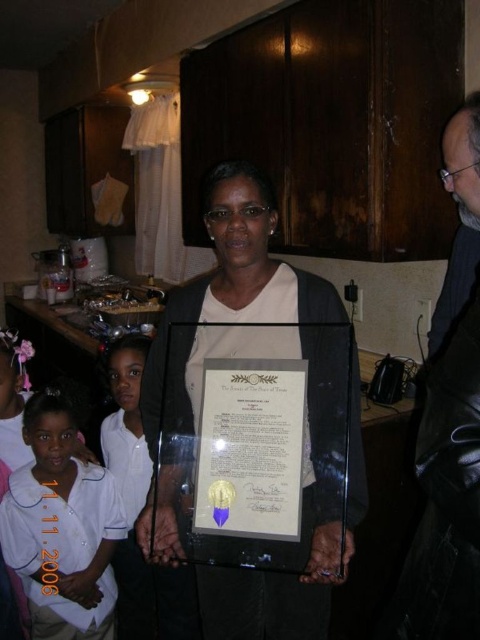
Question: Which object is the farthest from the matte black frame at center?

Choices:
 (A) white cotton shirt at lower left
 (B) matte gold certificate at center

Answer: (A)

Question: Observing the image, what is the correct spatial positioning of matte black frame at center in reference to white cotton shirt at lower left?

Choices:
 (A) above
 (B) below

Answer: (A)

Question: In this image, where is matte black frame at center located relative to white cotton shirt at lower left?

Choices:
 (A) right
 (B) left

Answer: (A)

Question: Based on their relative distances, which object is nearer to the white cotton shirt at lower left?

Choices:
 (A) matte gold certificate at center
 (B) matte black frame at center

Answer: (B)

Question: Which of these objects is positioned farthest from the matte gold certificate at center?

Choices:
 (A) matte black frame at center
 (B) white cotton shirt at lower left

Answer: (B)

Question: Is white cotton shirt at lower left smaller than matte gold certificate at center?

Choices:
 (A) no
 (B) yes

Answer: (A)